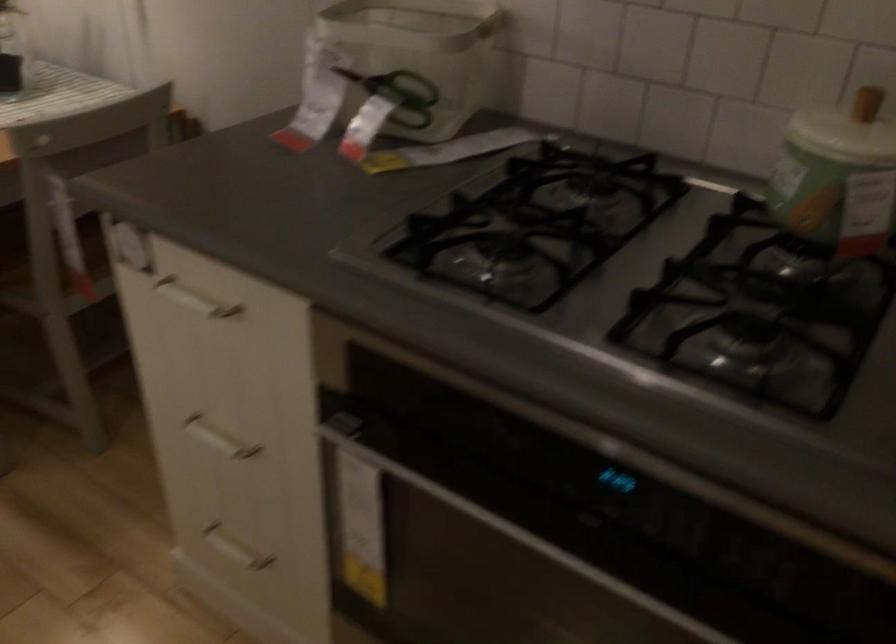
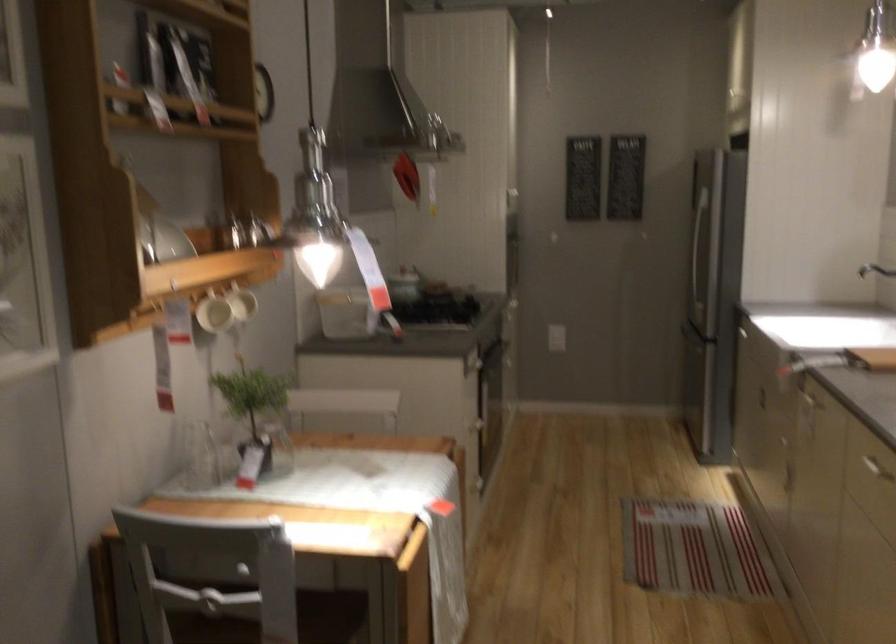
Question: I am providing you with two images of the same scene from different viewpoints. After the viewpoint changes to image2, which objects are now occluded?

Choices:
 (A) white mug handle
 (B) oven door handle
 (C) black handle scissors
 (D) round whiteboard eraser

Answer: (C)